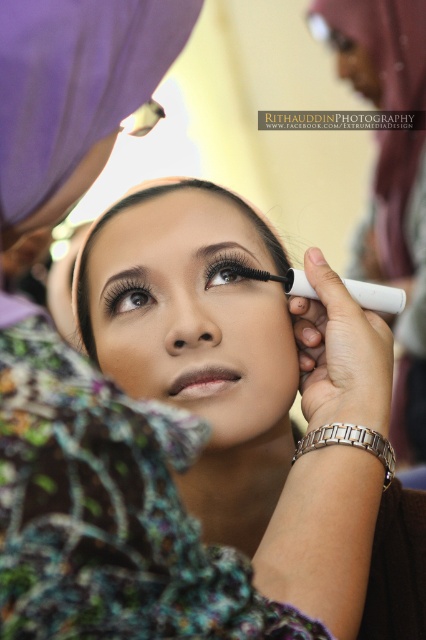
You are a makeup artist working on a client. You need to apply eyeliner to the brown matte eyebrow at upper left. Where exactly should you place the eyeliner on the client?

The brown matte eyebrow at upper left is located at point (x=127, y=288), so you should place the eyeliner at that exact coordinate to match the brow.